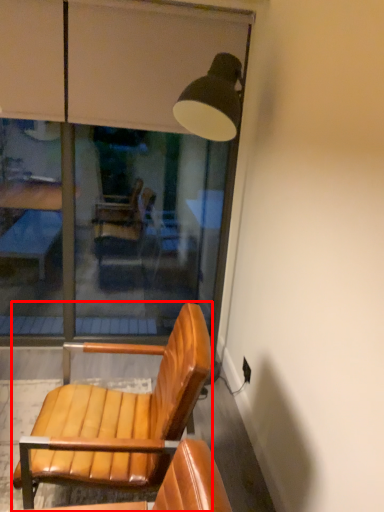
Question: From the image's perspective, what is the correct spatial relationship of chair (annotated by the red box) in relation to glass window?

Choices:
 (A) below
 (B) above

Answer: (A)